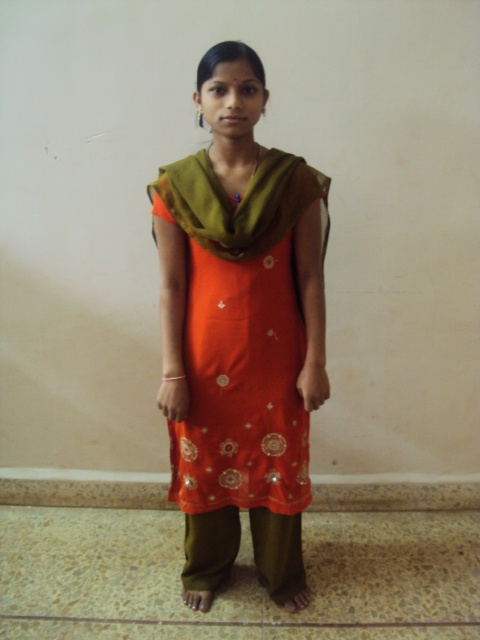
Can you confirm if orange satin kurta at center is positioned below green sheer scarf at upper center?

Yes.

Based on the photo, can you confirm if orange satin kurta at center is positioned to the left of green sheer scarf at upper center?

Correct, you'll find orange satin kurta at center to the left of green sheer scarf at upper center.

Between point (228, 509) and point (206, 192), which one is positioned behind?

The point (228, 509) is behind.

Locate an element on the screen. This screenshot has width=480, height=640. orange satin kurta at center is located at coordinates (240, 333).